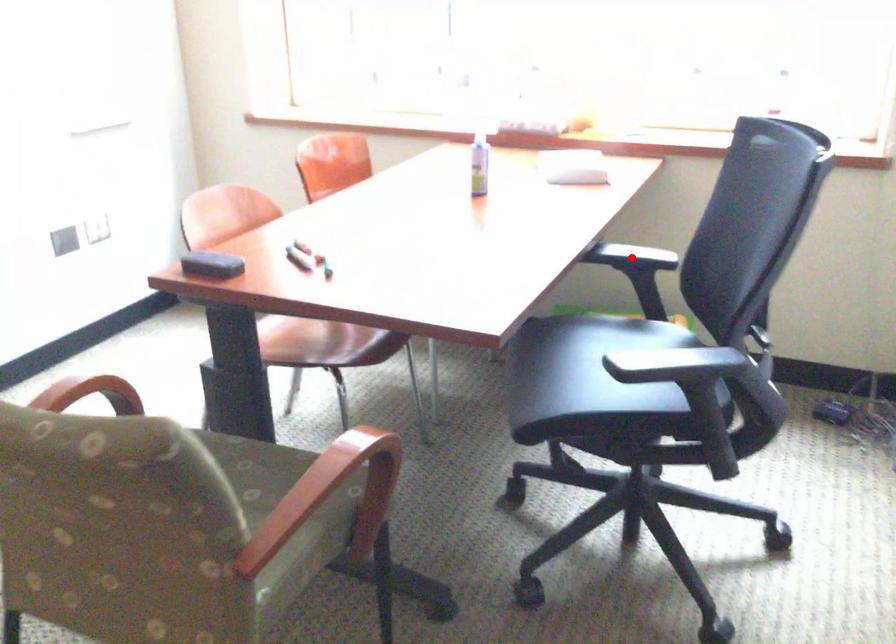
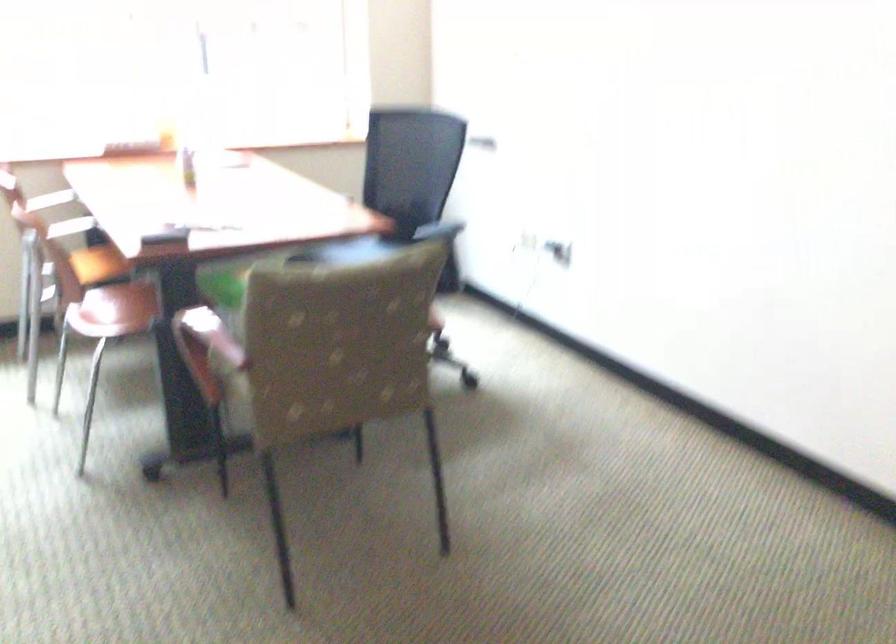
Question: I am providing you with two images of the same scene from different viewpoints. A red point is marked on the first image. At the location where the point appears in image 1, is it still visible in image 2?

Choices:
 (A) Yes
 (B) No

Answer: (B)